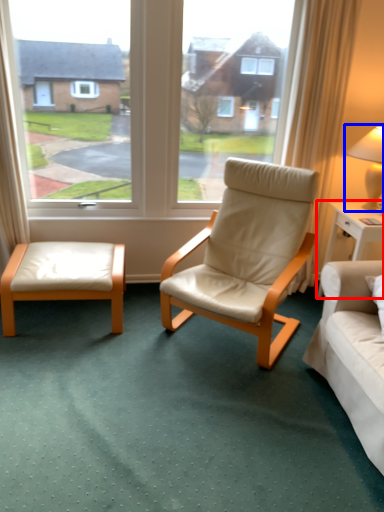
Question: Which object appears farthest to the camera in this image, nightstand (highlighted by a red box) or table lamp (highlighted by a blue box)?

Choices:
 (A) nightstand
 (B) table lamp

Answer: (A)